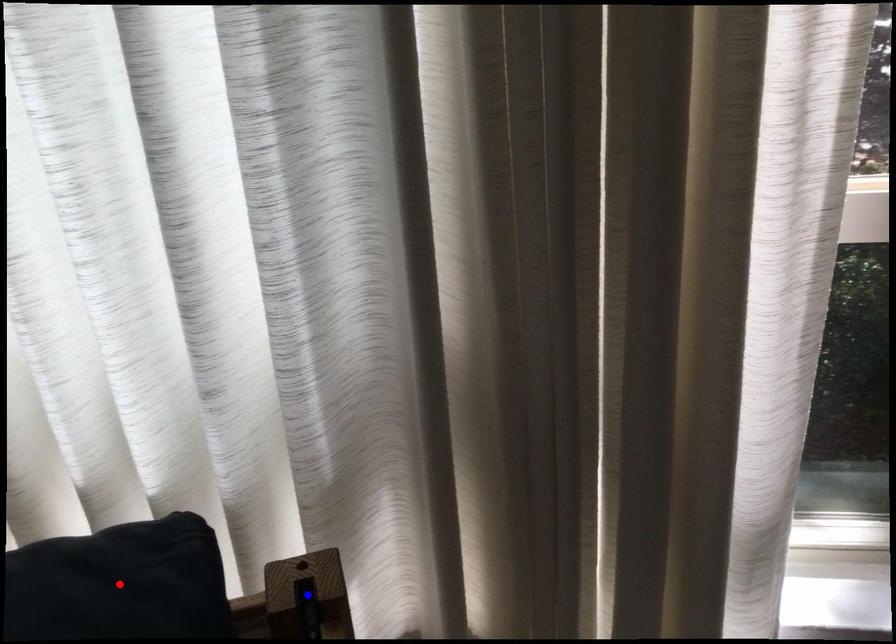
Question: Two points are marked on the image. Which point is closer to the camera?

Choices:
 (A) Blue point is closer.
 (B) Red point is closer.

Answer: (B)